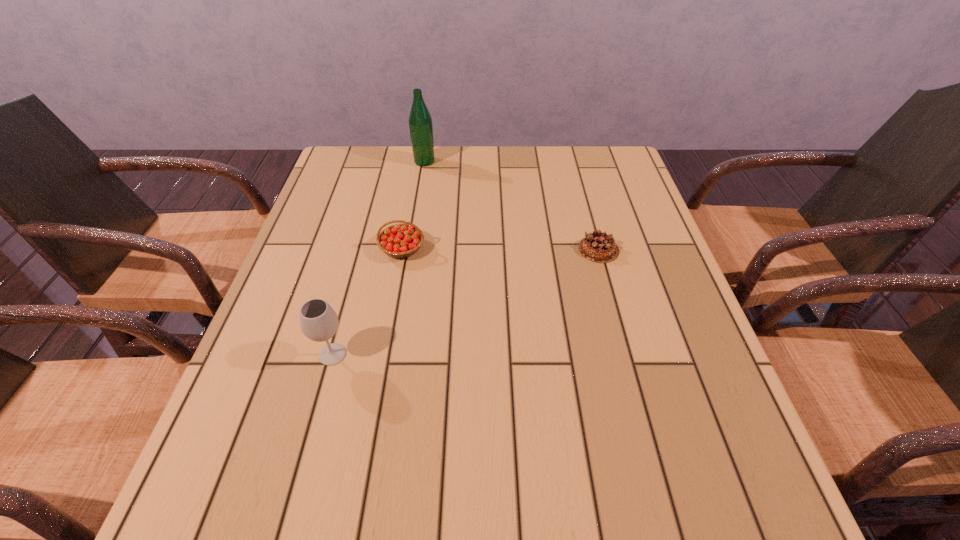
You are a GUI agent. You are given a task and a screenshot of the screen. Output one action in this format:
    pyautogui.click(x=<x>, y=<y>)
    Task: Click on the vacant space located 0.120m on the back of the chocolate cake
    
    Given the screenshot: What is the action you would take?
    pyautogui.click(x=588, y=208)

The image size is (960, 540). What are the coordinates of `object located at the far edge` in the screenshot? It's located at (420, 122).

Image resolution: width=960 pixels, height=540 pixels. I want to click on object positioned at the left edge, so click(x=319, y=322).

Locate an element on the screen. The width and height of the screenshot is (960, 540). object that is at the right edge is located at coordinates (598, 247).

The image size is (960, 540). I want to click on free space at the far edge of the desktop, so click(x=530, y=183).

The image size is (960, 540). Find the location of `vacant point at the left edge`. vacant point at the left edge is located at coordinates (318, 237).

At what (x,y) coordinates should I click in order to perform the action: click on vacant area at the right edge. Please return your answer as a coordinate pair (x, y). Looking at the image, I should click on (707, 430).

In the image, there is a desktop. Identify the location of free region at the far left corner. (384, 147).

Find the location of a particular element. The height and width of the screenshot is (540, 960). free region at the near left corner of the desktop is located at coordinates (275, 500).

I want to click on unoccupied position between the third shortest object and the strawberry, so click(368, 301).